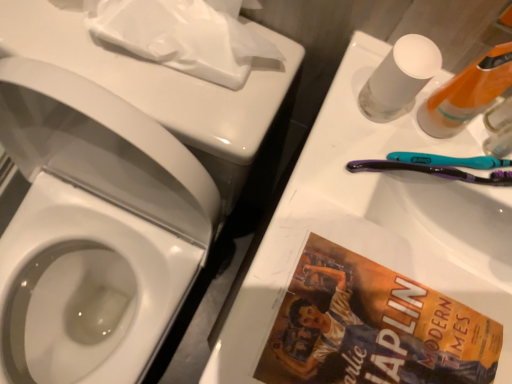
This screenshot has width=512, height=384. Identify the location of transparent plastic mouthwash at upper right, marked as the 1th mouthwash in a left-to-right arrangement. (399, 78).

Where is `white glossy sink at upper right`? white glossy sink at upper right is located at coordinates click(372, 224).

From the image's perspective, who appears lower, translucent plastic bottle at upper right, the 1th mouthwash when ordered from right to left, or white matte toilet paper at upper left?

translucent plastic bottle at upper right, the 1th mouthwash when ordered from right to left.

From a real-world perspective, is translucent plastic bottle at upper right, the 1th mouthwash when ordered from right to left, under white matte toilet paper at upper left?

No, from a real-world perspective, translucent plastic bottle at upper right, the 1th mouthwash when ordered from right to left, is not below white matte toilet paper at upper left.

Does translucent plastic bottle at upper right, the 1th mouthwash when ordered from right to left, touch white matte toilet paper at upper left?

No, translucent plastic bottle at upper right, the 1th mouthwash when ordered from right to left, is not making contact with white matte toilet paper at upper left.

Does translucent plastic bottle at upper right, placed as the second mouthwash when sorted from left to right, appear on the right side of white matte toilet paper at upper left?

Yes, translucent plastic bottle at upper right, placed as the second mouthwash when sorted from left to right, is to the right of white matte toilet paper at upper left.

In order to click on toilet paper on the left of orange plastic bottle at upper right in this screenshot , I will do `click(182, 36)`.

Based on their positions, is white matte toilet paper at upper left located to the left or right of orange plastic bottle at upper right?

white matte toilet paper at upper left is positioned on orange plastic bottle at upper right's left side.

From the image's perspective, is white matte toilet paper at upper left above or below orange plastic bottle at upper right?

white matte toilet paper at upper left is above orange plastic bottle at upper right.

Based on the photo, what's the angular difference between white matte toilet paper at upper left and orange plastic bottle at upper right's facing directions?

The facing directions of white matte toilet paper at upper left and orange plastic bottle at upper right are 47.7 degrees apart.

Looking at this image, considering the sizes of objects translucent plastic bottle at upper right, placed as the second mouthwash when sorted from left to right, and purple plastic toothbrush at right in the image provided, who is shorter, translucent plastic bottle at upper right, placed as the second mouthwash when sorted from left to right, or purple plastic toothbrush at right?

purple plastic toothbrush at right is shorter.

Is translucent plastic bottle at upper right, placed as the second mouthwash when sorted from left to right, in contact with purple plastic toothbrush at right?

Yes, translucent plastic bottle at upper right, placed as the second mouthwash when sorted from left to right, is right next to purple plastic toothbrush at right and making contact.

Considering the sizes of objects translucent plastic bottle at upper right, placed as the second mouthwash when sorted from left to right, and purple plastic toothbrush at right in the image provided, who is smaller, translucent plastic bottle at upper right, placed as the second mouthwash when sorted from left to right, or purple plastic toothbrush at right?

translucent plastic bottle at upper right, placed as the second mouthwash when sorted from left to right, is smaller.

The height and width of the screenshot is (384, 512). In order to click on toothbrush behind the translucent plastic bottle at upper right, placed as the second mouthwash when sorted from left to right in this screenshot , I will do `click(431, 171)`.

Is white matte toilet paper at upper left positioned with its back to translucent plastic bottle at upper right, placed as the second mouthwash when sorted from left to right?

No, white matte toilet paper at upper left is not facing the opposite direction of translucent plastic bottle at upper right, placed as the second mouthwash when sorted from left to right.

Which object is positioned more to the left, white matte toilet paper at upper left or translucent plastic bottle at upper right, the 1th mouthwash when ordered from right to left?

From the viewer's perspective, white matte toilet paper at upper left appears more on the left side.

Considering the sizes of objects white matte toilet paper at upper left and translucent plastic bottle at upper right, the 1th mouthwash when ordered from right to left, in the image provided, who is shorter, white matte toilet paper at upper left or translucent plastic bottle at upper right, the 1th mouthwash when ordered from right to left,?

white matte toilet paper at upper left is shorter.

From a real-world perspective, is white matte toilet paper at upper left over translucent plastic bottle at upper right, the 1th mouthwash when ordered from right to left?

Actually, white matte toilet paper at upper left is physically below translucent plastic bottle at upper right, the 1th mouthwash when ordered from right to left, in the real world.

Would you consider purple plastic toothbrush at right to be distant from transparent plastic mouthwash at upper right, which is the second mouthwash in right-to-left order?

They are positioned close to each other.

From a real-world perspective, is purple plastic toothbrush at right positioned over transparent plastic mouthwash at upper right, which is the second mouthwash in right-to-left order, based on gravity?

Actually, purple plastic toothbrush at right is physically below transparent plastic mouthwash at upper right, which is the second mouthwash in right-to-left order, in the real world.

Is transparent plastic mouthwash at upper right, which is the second mouthwash in right-to-left order, at the back of purple plastic toothbrush at right?

purple plastic toothbrush at right is not turned away from transparent plastic mouthwash at upper right, which is the second mouthwash in right-to-left order.

Locate an element on the screen. toothbrush behind the transparent plastic mouthwash at upper right, marked as the 1th mouthwash in a left-to-right arrangement is located at coordinates (431, 171).

Between point (214, 362) and point (496, 123), which one is positioned behind?

The point (496, 123) is more distant.

Where is `mouthwash that is the 2nd one when counting backward from the white glossy sink at upper right`? This screenshot has height=384, width=512. mouthwash that is the 2nd one when counting backward from the white glossy sink at upper right is located at coordinates (499, 129).

Who is bigger, white glossy sink at upper right or translucent plastic bottle at upper right, placed as the second mouthwash when sorted from left to right?

With larger size is white glossy sink at upper right.

Considering the relative positions of white glossy sink at upper right and translucent plastic bottle at upper right, placed as the second mouthwash when sorted from left to right, in the image provided, is white glossy sink at upper right behind translucent plastic bottle at upper right, placed as the second mouthwash when sorted from left to right,?

No, it is not.

Considering the sizes of objects white glossy sink at upper right and purple plastic toothbrush at right in the image provided, who is thinner, white glossy sink at upper right or purple plastic toothbrush at right?

purple plastic toothbrush at right.

Does white glossy sink at upper right touch purple plastic toothbrush at right?

Yes, white glossy sink at upper right is touching purple plastic toothbrush at right.

Between point (391, 226) and point (502, 160), which one is positioned in front?

Positioned in front is point (502, 160).

Is white glossy sink at upper right smaller than purple plastic toothbrush at right?

No, white glossy sink at upper right is not smaller than purple plastic toothbrush at right.

Locate an element on the screen. This screenshot has height=384, width=512. toilet paper behind the translucent plastic bottle at upper right, placed as the second mouthwash when sorted from left to right is located at coordinates (182, 36).

What are the coordinates of `toilet paper above the orange plastic bottle at upper right (from the image's perspective)` in the screenshot? It's located at (182, 36).

From the image, which object appears to be farther from orange plastic bottle at upper right, white glossy sink at upper right or transparent plastic mouthwash at upper right, which is the second mouthwash in right-to-left order?

white glossy sink at upper right is positioned further to the anchor orange plastic bottle at upper right.

Which object lies further to the anchor point purple plastic toothbrush at right, translucent plastic bottle at upper right, the 1th mouthwash when ordered from right to left, or white matte toilet paper at upper left?

Among the two, white matte toilet paper at upper left is located further to purple plastic toothbrush at right.

Looking at the image, which one is located further to translucent plastic bottle at upper right, the 1th mouthwash when ordered from right to left, transparent plastic mouthwash at upper right, which is the second mouthwash in right-to-left order, or orange plastic bottle at upper right?

Based on the image, transparent plastic mouthwash at upper right, which is the second mouthwash in right-to-left order, appears to be further to translucent plastic bottle at upper right, the 1th mouthwash when ordered from right to left.

Looking at the image, which one is located further to white matte toilet paper at upper left, orange plastic bottle at upper right or white glossy sink at upper right?

The object further to white matte toilet paper at upper left is orange plastic bottle at upper right.

Estimate the real-world distances between objects in this image. Which object is closer to white matte toilet paper at upper left, translucent plastic bottle at upper right, the 1th mouthwash when ordered from right to left, or transparent plastic mouthwash at upper right, marked as the 1th mouthwash in a left-to-right arrangement?

Based on the image, transparent plastic mouthwash at upper right, marked as the 1th mouthwash in a left-to-right arrangement, appears to be nearer to white matte toilet paper at upper left.

From the image, which object appears to be farther from transparent plastic mouthwash at upper right, marked as the 1th mouthwash in a left-to-right arrangement, purple plastic toothbrush at right or translucent plastic bottle at upper right, the 1th mouthwash when ordered from right to left?

The object further to transparent plastic mouthwash at upper right, marked as the 1th mouthwash in a left-to-right arrangement, is translucent plastic bottle at upper right, the 1th mouthwash when ordered from right to left.

When comparing their distances from orange plastic bottle at upper right, does purple plastic toothbrush at right or translucent plastic bottle at upper right, placed as the second mouthwash when sorted from left to right, seem further?

purple plastic toothbrush at right is further to orange plastic bottle at upper right.

Based on their spatial positions, is white matte toilet paper at upper left or purple plastic toothbrush at right further from orange plastic bottle at upper right?

white matte toilet paper at upper left is positioned further to the anchor orange plastic bottle at upper right.

Where is `cleaning product between transparent plastic mouthwash at upper right, which is the second mouthwash in right-to-left order, and translucent plastic bottle at upper right, placed as the second mouthwash when sorted from left to right, in the horizontal direction`? This screenshot has width=512, height=384. cleaning product between transparent plastic mouthwash at upper right, which is the second mouthwash in right-to-left order, and translucent plastic bottle at upper right, placed as the second mouthwash when sorted from left to right, in the horizontal direction is located at coordinates (467, 93).

Locate an element on the screen. The height and width of the screenshot is (384, 512). mouthwash between white matte toilet paper at upper left and purple plastic toothbrush at right in the horizontal direction is located at coordinates (399, 78).

Where is `cleaning product between white matte toilet paper at upper left and translucent plastic bottle at upper right, the 1th mouthwash when ordered from right to left`? The height and width of the screenshot is (384, 512). cleaning product between white matte toilet paper at upper left and translucent plastic bottle at upper right, the 1th mouthwash when ordered from right to left is located at coordinates (467, 93).

Locate an element on the screen. This screenshot has width=512, height=384. porcelain located between white matte toilet paper at upper left and orange plastic bottle at upper right in the left-right direction is located at coordinates (372, 224).